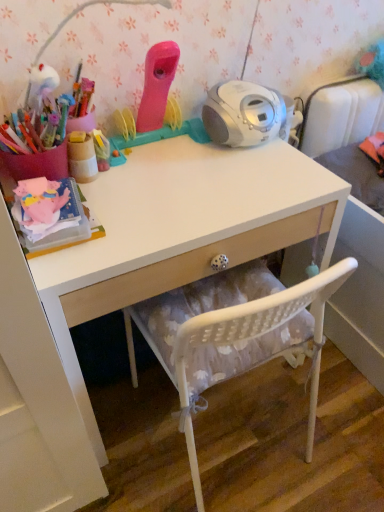
This screenshot has height=512, width=384. I want to click on free space on the front side of wooden cup at upper left, so click(117, 215).